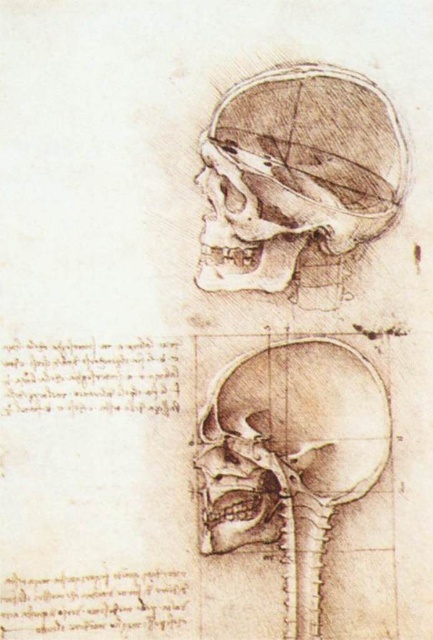
Question: Can you confirm if graphite pencil skull at upper center is smaller than brown pencil sketch skull at center?

Choices:
 (A) yes
 (B) no

Answer: (B)

Question: Does graphite pencil skull at upper center appear on the right side of brown pencil sketch skull at center?

Choices:
 (A) yes
 (B) no

Answer: (A)

Question: Does graphite pencil skull at upper center appear on the right side of brown pencil sketch skull at center?

Choices:
 (A) no
 (B) yes

Answer: (B)

Question: Which point appears closest to the camera in this image?

Choices:
 (A) (245, 493)
 (B) (387, 218)

Answer: (A)